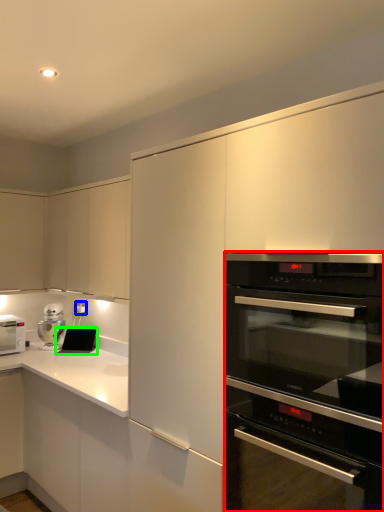
Question: Considering the real-world distances, which object is closest to oven (highlighted by a red box)? electric outlet (highlighted by a blue box) or appliance (highlighted by a green box).

Choices:
 (A) electric outlet
 (B) appliance

Answer: (B)